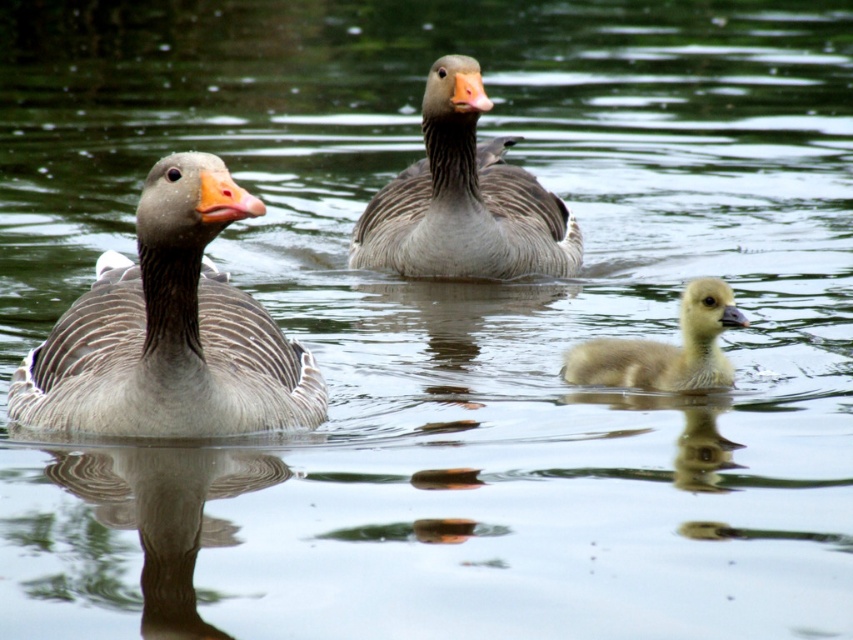
Question: Which object appears farthest from the camera in this image?

Choices:
 (A) yellow downy duckling at center
 (B) gray matte duck at center
 (C) gray matte duck at left

Answer: (B)

Question: From the image, what is the correct spatial relationship of gray matte duck at left in relation to gray matte duck at center?

Choices:
 (A) left
 (B) right

Answer: (A)

Question: Based on their relative distances, which object is farther from the gray matte duck at center?

Choices:
 (A) gray matte duck at left
 (B) yellow downy duckling at center

Answer: (A)

Question: Can you confirm if gray matte duck at center is positioned above yellow downy duckling at center?

Choices:
 (A) yes
 (B) no

Answer: (A)

Question: Is gray matte duck at left in front of gray matte duck at center?

Choices:
 (A) yes
 (B) no

Answer: (A)

Question: Which of these objects is positioned farthest from the gray matte duck at left?

Choices:
 (A) gray matte duck at center
 (B) yellow downy duckling at center

Answer: (A)